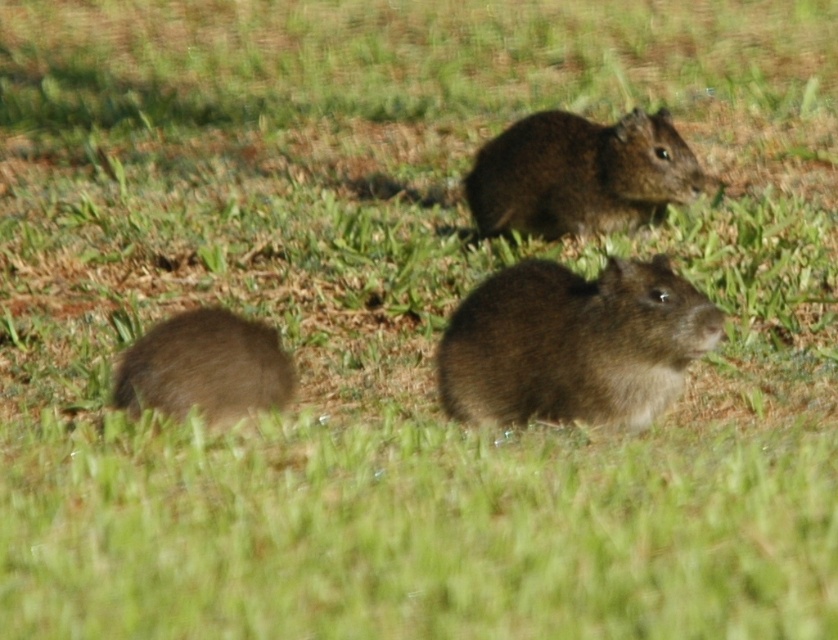
Identify the location of brown furry mouse at center. The image size is (838, 640). (573, 344).

Between brown furry mouse at center and brown furry mouse at upper center, which one is positioned higher?

Positioned higher is brown furry mouse at upper center.

Does point (482, 349) come closer to viewer compared to point (511, 193)?

Yes, it is in front of point (511, 193).

Locate an element on the screen. This screenshot has width=838, height=640. brown furry mouse at center is located at coordinates (573, 344).

Between point (678, 156) and point (132, 356), which one is positioned in front?

Point (132, 356)

Is brown furry mouse at upper center above brown furry mouse at lower left?

Yes, brown furry mouse at upper center is above brown furry mouse at lower left.

Locate an element on the screen. brown furry mouse at upper center is located at coordinates (580, 173).

The height and width of the screenshot is (640, 838). Find the location of `brown furry mouse at upper center`. brown furry mouse at upper center is located at coordinates (580, 173).

Does brown furry mouse at center have a lesser height compared to brown furry mouse at lower left?

No.

Who is more distant from viewer, (x=515, y=276) or (x=149, y=378)?

The point (x=515, y=276) is behind.

Between point (601, 385) and point (130, 413), which one is positioned behind?

Point (601, 385)

I want to click on brown furry mouse at center, so click(573, 344).